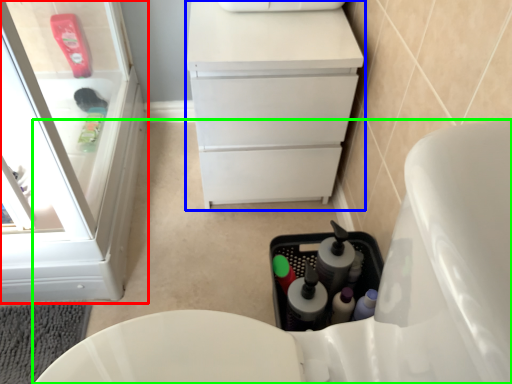
Question: Based on their relative distances, which object is farther from bathroom cabinet (highlighted by a red box)? Choose from vanity (highlighted by a blue box) and toilet (highlighted by a green box).

Choices:
 (A) vanity
 (B) toilet

Answer: (B)